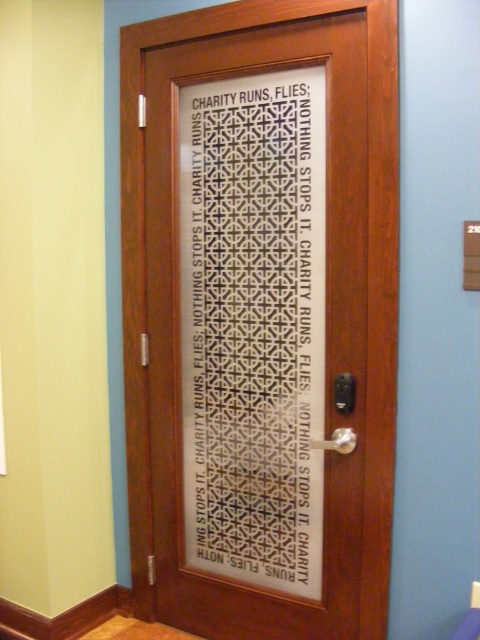
Question: Which point is farther from the camera taking this photo?

Choices:
 (A) (331, 484)
 (B) (210, 396)

Answer: (B)

Question: Is transparent glass door at center to the right of white lattice door at center from the viewer's perspective?

Choices:
 (A) no
 (B) yes

Answer: (A)

Question: Is transparent glass door at center to the right of white lattice door at center from the viewer's perspective?

Choices:
 (A) yes
 (B) no

Answer: (B)

Question: Which of the following is the farthest from the observer?

Choices:
 (A) (276, 262)
 (B) (372, 49)

Answer: (A)

Question: Is transparent glass door at center to the left of white lattice door at center from the viewer's perspective?

Choices:
 (A) yes
 (B) no

Answer: (A)